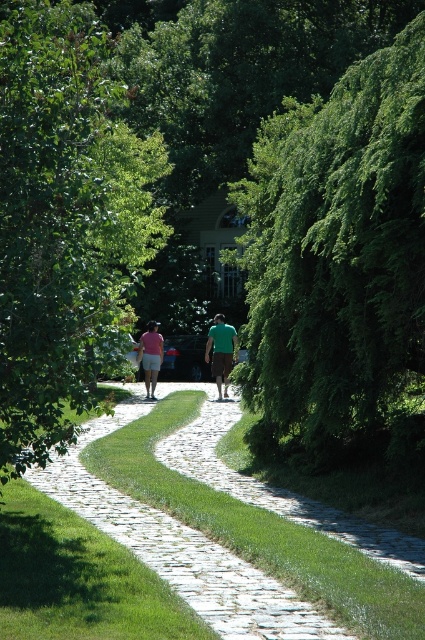
Can you confirm if green leafy tree at center is wider than pink cotton shorts at center?

Indeed, green leafy tree at center has a greater width compared to pink cotton shorts at center.

Who is more distant from viewer, (351, 356) or (144, 332)?

The point (144, 332) is behind.

Is point (384, 436) more distant than point (149, 337)?

No, it is not.

Locate an element on the screen. The image size is (425, 640). green leafy tree at center is located at coordinates (339, 268).

Does green leafy tree at left have a smaller size compared to green matte shirt at center?

No.

Is green leafy tree at left positioned at the back of green matte shirt at center?

No, it is not.

Is point (144, 148) positioned after point (224, 372)?

Yes, it is.

This screenshot has height=640, width=425. Identify the location of green leafy tree at left. (64, 221).

Which of these two, green leafy tree at left or matte pink shorts at center, stands shorter?

Standing shorter between the two is matte pink shorts at center.

Is green leafy tree at left smaller than matte pink shorts at center?

No.

Is point (19, 48) positioned in front of point (150, 369)?

Yes, point (19, 48) is closer to viewer.

Identify the location of green leafy tree at left. (64, 221).